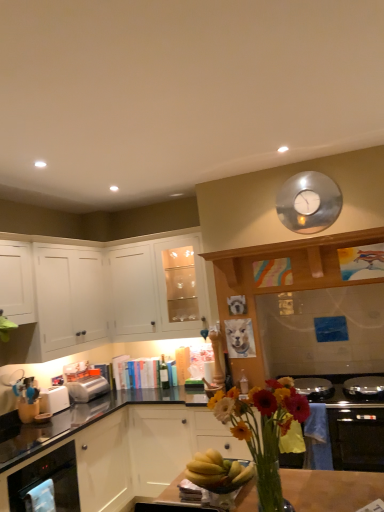
Question: From a real-world perspective, is satin silver toaster at lower left, the first toaster from the back, physically located above or below white matte cabinet at left, which is the third cabinetry from top to bottom?

Choices:
 (A) above
 (B) below

Answer: (A)

Question: Looking at their shapes, would you say satin silver toaster at lower left, acting as the 2th toaster starting from the front, is wider or thinner than white matte cabinet at left, which is the third cabinetry from top to bottom?

Choices:
 (A) wide
 (B) thin

Answer: (B)

Question: Which object is the farthest from the stainless steel oven at lower left?

Choices:
 (A) white matte cabinet at upper left, the first cabinetry viewed from the top
 (B) white plastic toaster at lower left, the 2th toaster in the back-to-front sequence
 (C) white matte cabinet at left, which is the first cabinetry in bottom-to-top order
 (D) white matte cabinet at left, positioned as the second cabinetry in bottom-to-top order
 (E) satin silver toaster at lower left, acting as the 2th toaster starting from the front

Answer: (A)

Question: Based on their relative distances, which object is farther from the white matte cabinet at upper left, the third cabinetry from the bottom?

Choices:
 (A) white matte cabinet at left, the 2th cabinetry in the top-to-bottom sequence
 (B) white plastic toaster at lower left, the 1th toaster from the front
 (C) translucent glass vase at center
 (D) satin silver toaster at lower left, acting as the 2th toaster starting from the front
 (E) stainless steel oven at lower left

Answer: (C)